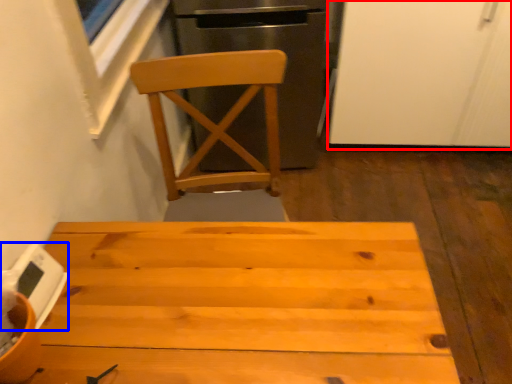
Question: Which object appears farthest to the camera in this image, screen door (highlighted by a red box) or appliance (highlighted by a blue box)?

Choices:
 (A) screen door
 (B) appliance

Answer: (A)